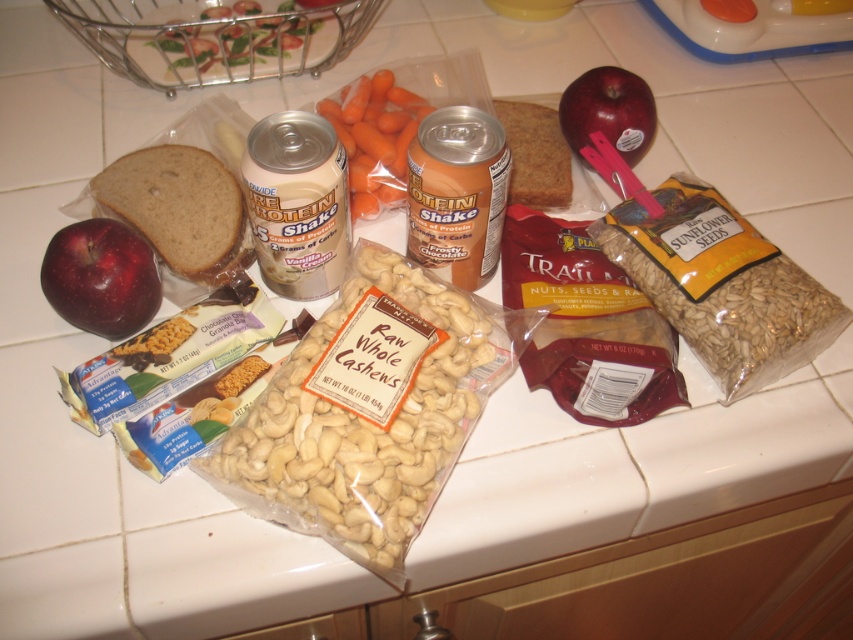
Question: Which of the following is the closest to the observer?

Choices:
 (A) (219, 180)
 (B) (300, 353)

Answer: (B)

Question: Is red matte apple at left positioned before red matte apple at upper right?

Choices:
 (A) no
 (B) yes

Answer: (B)

Question: In this image, where is light beige raw whole cashews at center located relative to orange smooth-textured carrots at center?

Choices:
 (A) left
 (B) right

Answer: (B)

Question: Can you confirm if brown matte bread at left is positioned above brown matte bread at center?

Choices:
 (A) yes
 (B) no

Answer: (B)

Question: Which object is positioned farthest from the orange smooth-textured carrots at center?

Choices:
 (A) brown matte bread at left
 (B) red matte apple at upper right
 (C) brown matte bread at center
 (D) red matte apple at left

Answer: (D)

Question: Which is nearer to the red matte apple at left?

Choices:
 (A) orange smooth-textured carrots at center
 (B) brown matte bread at left

Answer: (B)